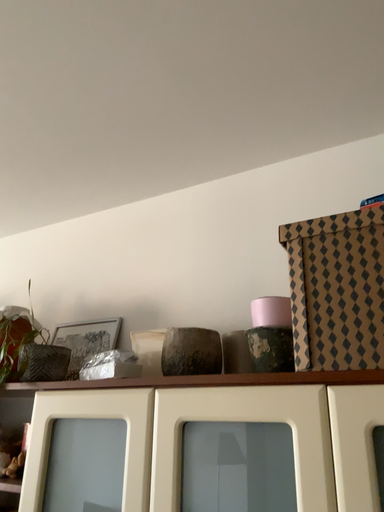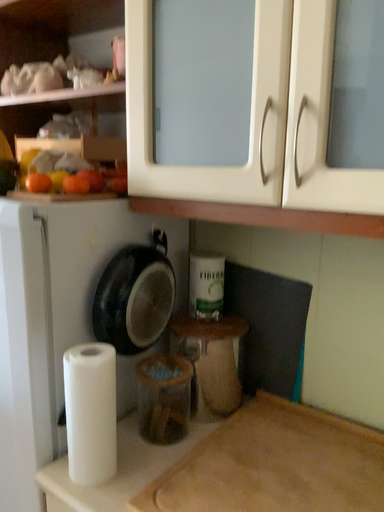
Question: Which way did the camera rotate in the video?

Choices:
 (A) rotated downward
 (B) rotated upward

Answer: (A)